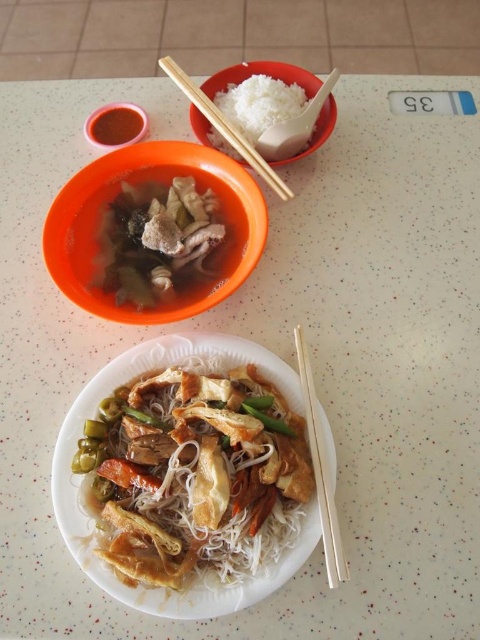
Question: Does shiny brown noodles at center come in front of wooden chopsticks at upper center?

Choices:
 (A) no
 (B) yes

Answer: (B)

Question: Which of the following is the closest to the observer?

Choices:
 (A) wooden chopsticks at upper center
 (B) orange plastic bowl at upper center
 (C) white matte rice at upper center

Answer: (B)

Question: Considering the real-world distances, which object is farthest from the wooden chopsticks at upper center?

Choices:
 (A) shiny brown noodles at center
 (B) white matte rice at upper center

Answer: (A)

Question: Is dark brown meaty broth at upper center to the right of wooden chopsticks at upper center from the viewer's perspective?

Choices:
 (A) yes
 (B) no

Answer: (B)

Question: Which of the following is the closest to the observer?

Choices:
 (A) white matte rice at upper center
 (B) orange plastic bowl at upper center

Answer: (B)

Question: Does wooden chopsticks at upper center appear under shiny brown sauce at upper left?

Choices:
 (A) no
 (B) yes

Answer: (A)